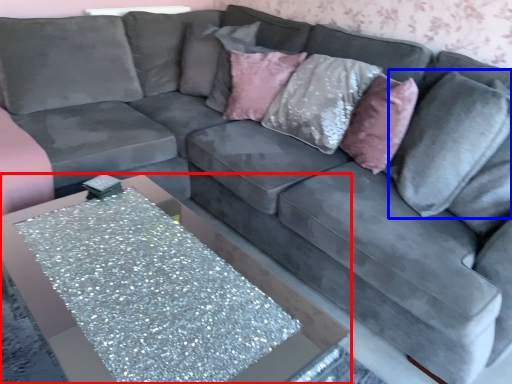
Question: Which point is further to the camera, table (highlighted by a red box) or pillow (highlighted by a blue box)?

Choices:
 (A) table
 (B) pillow

Answer: (B)